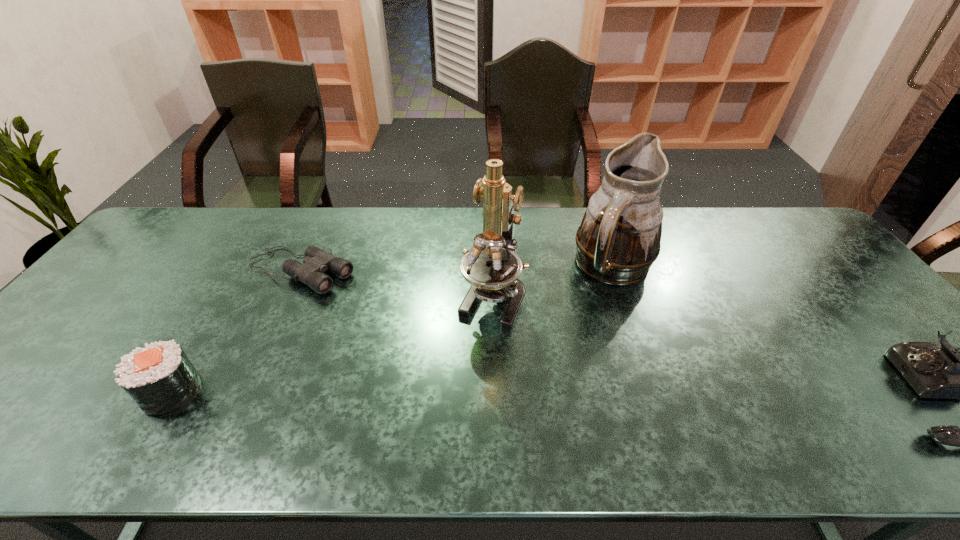
This screenshot has width=960, height=540. Identify the location of sushi. (159, 377).

The height and width of the screenshot is (540, 960). I want to click on the shortest object, so click(x=316, y=262).

Find the location of a particular element. This screenshot has width=960, height=540. the second tallest object is located at coordinates (618, 240).

I want to click on the fourth object from left to right, so click(x=618, y=240).

This screenshot has height=540, width=960. Find the location of `microscope`. microscope is located at coordinates (492, 268).

Find the location of `vacant space positioned on the left of the sushi`. vacant space positioned on the left of the sushi is located at coordinates (16, 392).

You are a GUI agent. You are given a task and a screenshot of the screen. Output one action in this format:
    pyautogui.click(x=<x>, y=<y>)
    Task: Click on the free space located at the eyepiece of the binoculars
    This screenshot has width=960, height=540.
    Given the screenshot: What is the action you would take?
    pyautogui.click(x=359, y=295)

I want to click on free space located at the eyepiece of the binoculars, so click(x=395, y=314).

Find the location of a particular element. Image resolution: width=960 pixels, height=540 pixels. vacant space situated at the eyepiece of the binoculars is located at coordinates (452, 344).

In order to click on free region located from the spout of the fourth object from left to right in this screenshot , I will do `click(636, 314)`.